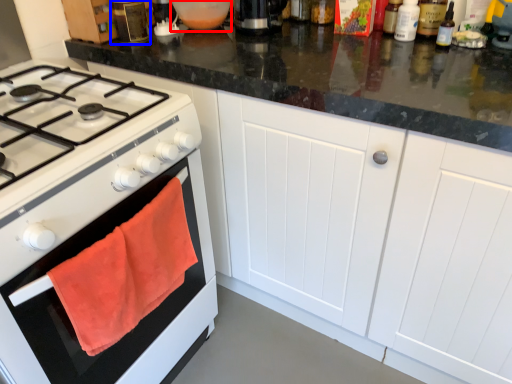
Question: Which point is further to the camera, appliance (highlighted by a red box) or kitchen appliance (highlighted by a blue box)?

Choices:
 (A) appliance
 (B) kitchen appliance

Answer: (A)